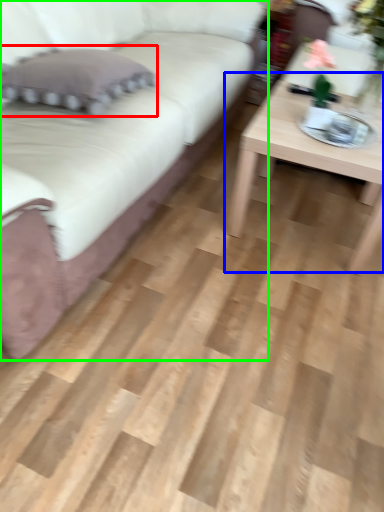
Question: Considering the real-world distances, which object is farthest from pillow (highlighted by a red box)? coffee table (highlighted by a blue box) or studio couch (highlighted by a green box)?

Choices:
 (A) coffee table
 (B) studio couch

Answer: (A)